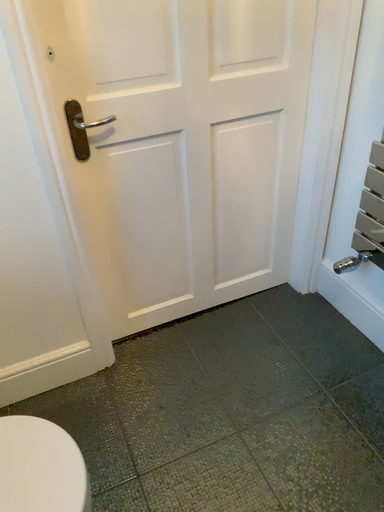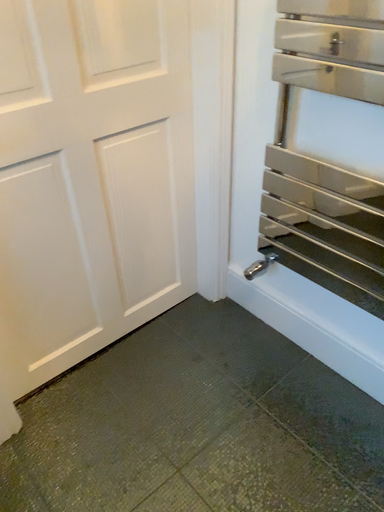
Question: Which way did the camera rotate in the video?

Choices:
 (A) rotated left
 (B) rotated right

Answer: (B)